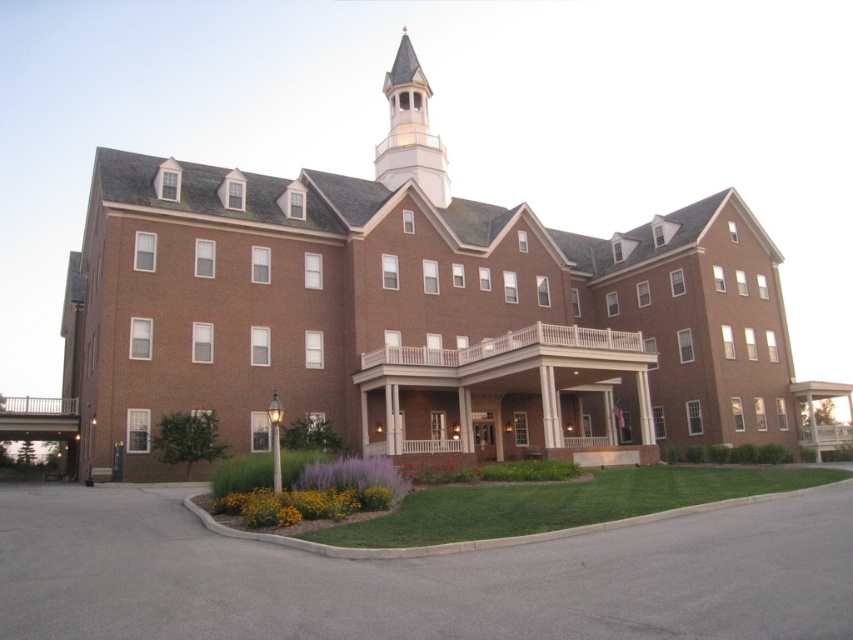
Who is taller, gray asphalt driveway at lower center or orange textured flowers at lower center?

gray asphalt driveway at lower center is taller.

Consider the image. Who is higher up, gray asphalt driveway at lower center or orange textured flowers at lower center?

orange textured flowers at lower center

Is point (567, 541) positioned in front of point (392, 492)?

That is True.

This screenshot has height=640, width=853. Identify the location of gray asphalt driveway at lower center. (418, 577).

Is orange textured flowers at lower center positioned behind purple matte flower at center?

No, it is not.

This screenshot has width=853, height=640. Identify the location of orange textured flowers at lower center. (300, 504).

Identify the location of orange textured flowers at lower center. (300, 504).

Where is `orange textured flowers at lower center`? The width and height of the screenshot is (853, 640). orange textured flowers at lower center is located at coordinates (300, 504).

Is brown brick church at center further to camera compared to gray asphalt driveway at lower center?

Yes, brown brick church at center is behind gray asphalt driveway at lower center.

Between brown brick church at center and gray asphalt driveway at lower center, which one appears on the right side from the viewer's perspective?

From the viewer's perspective, gray asphalt driveway at lower center appears more on the right side.

Is point (480, 232) positioned after point (378, 627)?

Yes, it is behind point (378, 627).

Where is `brown brick church at center`? brown brick church at center is located at coordinates (410, 321).